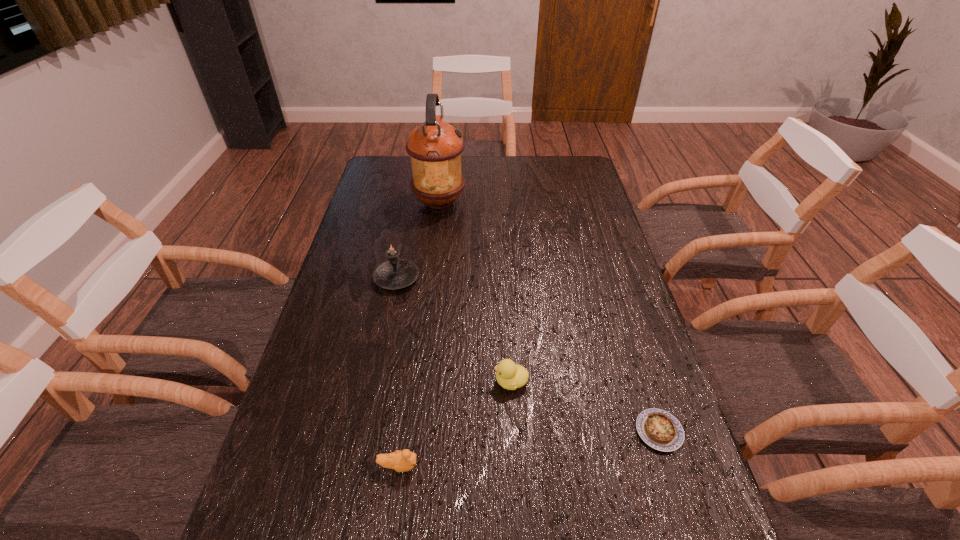
Where is `vacant area situated on the back of the tallest object`? vacant area situated on the back of the tallest object is located at coordinates (443, 176).

You are a GUI agent. You are given a task and a screenshot of the screen. Output one action in this format:
    pyautogui.click(x=<x>, y=<y>)
    Task: Click on the blank space located 0.220m on the front of the fourth nearest object
    This screenshot has width=960, height=540.
    Given the screenshot: What is the action you would take?
    pyautogui.click(x=381, y=356)

The image size is (960, 540). In order to click on vacant space situated 0.240m at the beak of the right duckling in this screenshot , I will do `click(394, 381)`.

Find the location of a particular element. free location located 0.190m at the beak of the right duckling is located at coordinates (415, 381).

Where is `vacant space located at the beak of the right duckling`? The image size is (960, 540). vacant space located at the beak of the right duckling is located at coordinates (336, 381).

Where is `vacant space located on the face of the shorter duckling`? vacant space located on the face of the shorter duckling is located at coordinates (583, 465).

The width and height of the screenshot is (960, 540). Identify the location of vacant point located on the left of the fourth farthest object. (476, 431).

Where is `object positioned at the left edge`? This screenshot has height=540, width=960. object positioned at the left edge is located at coordinates (395, 273).

The width and height of the screenshot is (960, 540). What are the coordinates of `object present at the right edge` in the screenshot? It's located at (659, 429).

Locate an element on the screen. The image size is (960, 540). blank area at the left edge is located at coordinates (399, 204).